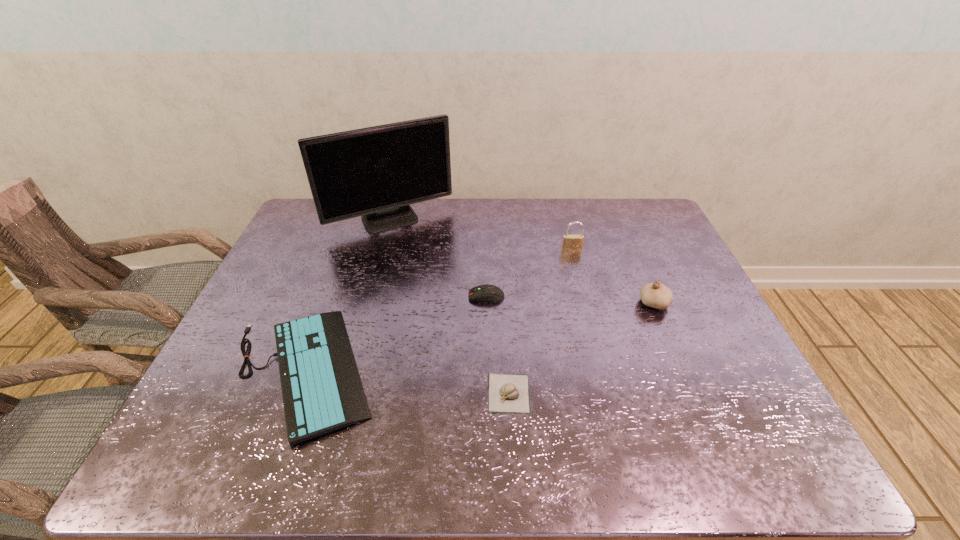
Find the location of a particular element. This screenshot has height=540, width=960. vacant space located 0.120m on the front-facing side of the farthest object is located at coordinates (380, 261).

Image resolution: width=960 pixels, height=540 pixels. I want to click on free region located 0.200m on the front-facing side of the second farthest object, so click(x=583, y=295).

Find the location of a particular element. This screenshot has width=960, height=540. free region located on the front of the rightmost object is located at coordinates (708, 433).

Where is `free space located 0.180m on the button of the fourth tallest object`? free space located 0.180m on the button of the fourth tallest object is located at coordinates (405, 296).

Identify the location of vacant region located 0.250m on the button of the fourth tallest object. (380, 296).

Where is `vacant space situated 0.400m on the button of the fourth tallest object`? This screenshot has width=960, height=540. vacant space situated 0.400m on the button of the fourth tallest object is located at coordinates (327, 296).

Locate an element on the screen. This screenshot has width=960, height=540. vacant space located 0.360m on the right of the shorter garlic is located at coordinates (687, 393).

Find the location of a particular element. vacant point located 0.260m on the right of the computer keyboard is located at coordinates (490, 370).

Where is `object that is positioned at the far edge`? This screenshot has height=540, width=960. object that is positioned at the far edge is located at coordinates (376, 172).

Where is `object present at the near edge`? This screenshot has height=540, width=960. object present at the near edge is located at coordinates (322, 391).